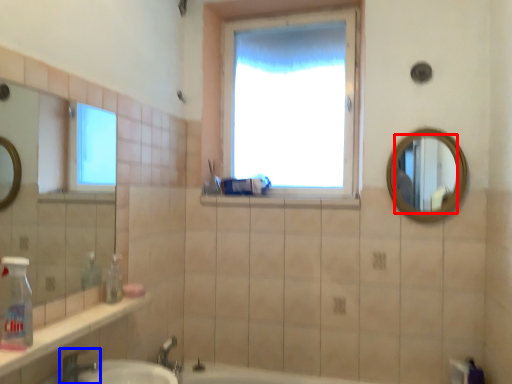
Question: Which of the following is the farthest to the observer, mirror (highlighted by a red box) or tap (highlighted by a blue box)?

Choices:
 (A) mirror
 (B) tap

Answer: (A)